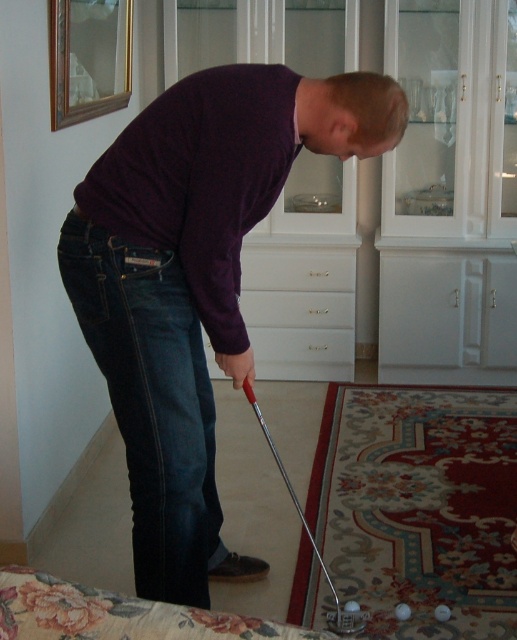
From the picture: You are a tailor measuring the height of items in the room for a new interior design project. You need to know which item is taller between the dark blue denim jeans at lower left and the white glossy drawer at center. Can you tell me which one is taller?

The dark blue denim jeans at lower left is taller than the white glossy drawer at center according to the description.

You are a tailor who needs to determine if the purple matte sweater at center can be folded and placed into the white glossy drawer at center. Based on their sizes, is this possible?

The purple matte sweater at center is much taller than the white glossy drawer at center, so it cannot be folded and placed into the drawer without being compressed or damaged.